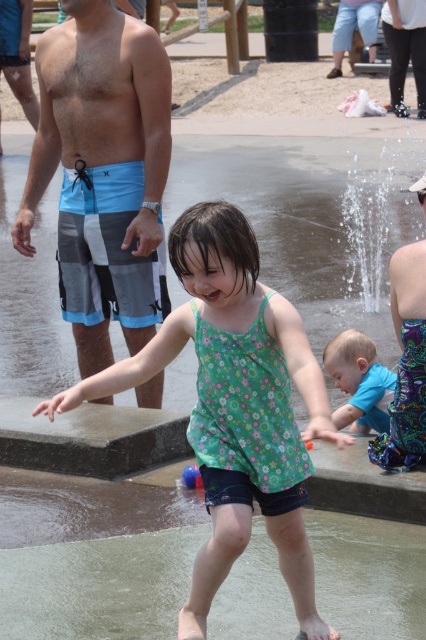
Between point (409, 257) and point (365, 413), which one is positioned behind?

The point (365, 413) is behind.

At what (x,y) coordinates should I click in order to perform the action: click on blue striped board shorts at left. Please return your answer as a coordinate pair (x, y). Looking at the image, I should click on (405, 364).

Can you confirm if blue and gray board shorts at left is positioned to the left of blue striped board shorts at left?

Indeed, blue and gray board shorts at left is positioned on the left side of blue striped board shorts at left.

Which is more to the left, blue and gray board shorts at left or blue striped board shorts at left?

blue and gray board shorts at left is more to the left.

I want to click on blue and gray board shorts at left, so click(x=103, y=160).

Who is shorter, green floral dress at center or blue striped board shorts at left?

blue striped board shorts at left

Between green floral dress at center and blue striped board shorts at left, which one is positioned higher?

blue striped board shorts at left is higher up.

Who is more forward, (193, 621) or (411, 301)?

Point (193, 621) is in front.

Identify the location of green floral dress at center. The width and height of the screenshot is (426, 640). (235, 404).